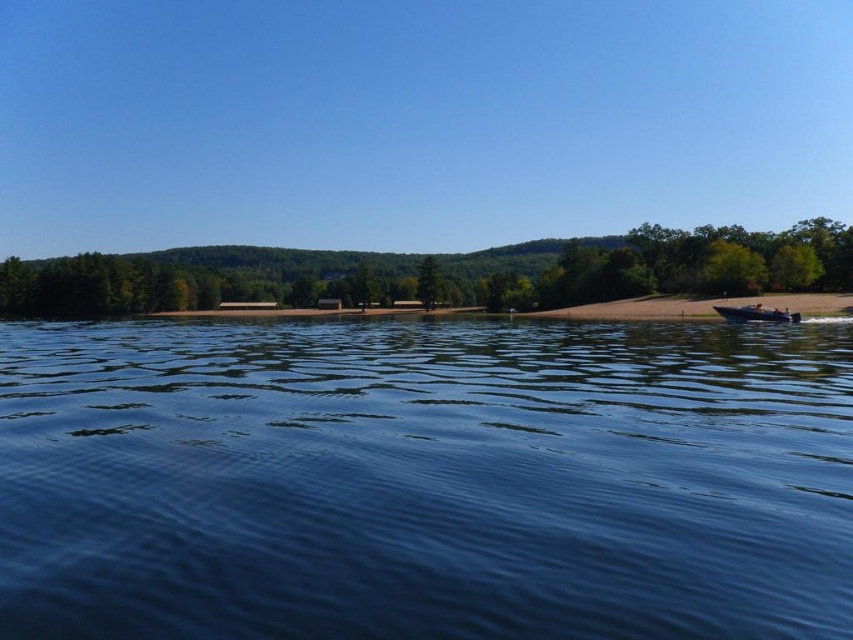
Question: Is green leafy tree at center smaller than shiny silver speedboat at right?

Choices:
 (A) no
 (B) yes

Answer: (A)

Question: Does shiny silver speedboat at right appear on the right side of green matte tree at center?

Choices:
 (A) no
 (B) yes

Answer: (B)

Question: Which of the following is the farthest from the observer?

Choices:
 (A) tap(514, 332)
 (B) tap(57, 291)
 (C) tap(428, 259)
 (D) tap(747, 316)

Answer: (B)

Question: Is blue smooth water at center positioned at the back of green matte tree at center?

Choices:
 (A) yes
 (B) no

Answer: (B)

Question: Estimate the real-world distances between objects in this image. Which object is farther from the blue smooth water at center?

Choices:
 (A) shiny silver speedboat at right
 (B) green leafy tree at center
 (C) green matte tree at center

Answer: (C)

Question: Which object is farther from the camera taking this photo?

Choices:
 (A) green matte tree at center
 (B) green leafy tree at center
 (C) shiny silver speedboat at right
 (D) blue smooth water at center

Answer: (A)